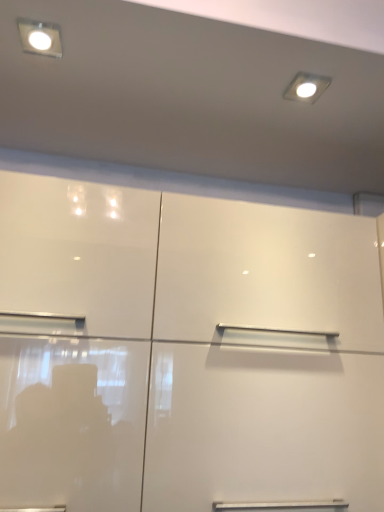
Question: From a real-world perspective, is glossy white cupboard at center physically located above or below matte white square at upper left?

Choices:
 (A) above
 (B) below

Answer: (B)

Question: Considering the positions of point (248, 417) and point (54, 52), is point (248, 417) closer or farther from the camera than point (54, 52)?

Choices:
 (A) closer
 (B) farther

Answer: (B)

Question: Which of these objects is positioned farthest from the matte white light fixture at upper right?

Choices:
 (A) matte white square at upper left
 (B) glossy white cupboard at center

Answer: (B)

Question: Estimate the real-world distances between objects in this image. Which object is farther from the matte white square at upper left?

Choices:
 (A) matte white light fixture at upper right
 (B) glossy white cupboard at center

Answer: (B)